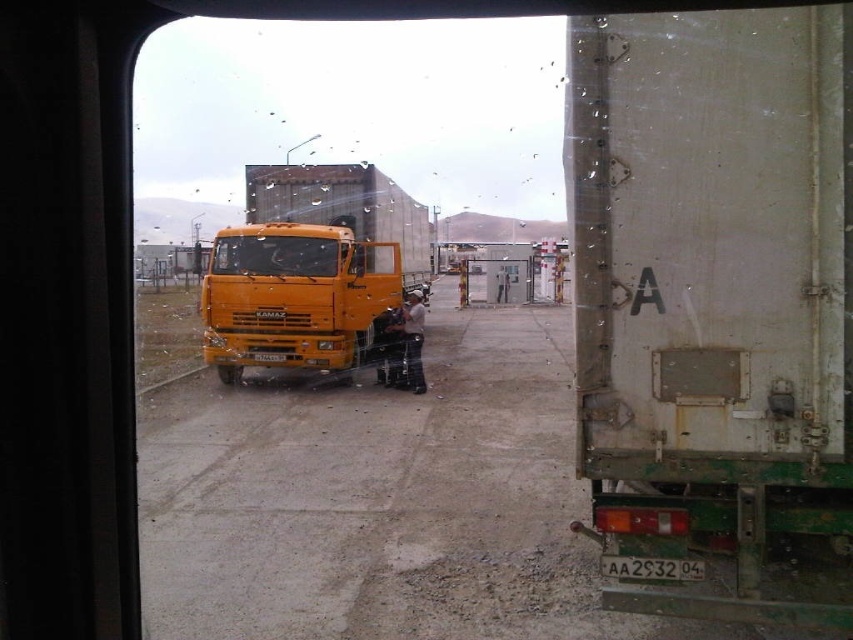
Question: Does rusty metal trailer at right appear on the left side of orange matte truck at center?

Choices:
 (A) no
 (B) yes

Answer: (A)

Question: Which point is farther to the camera?

Choices:
 (A) orange matte truck at center
 (B) rusty metal trailer at right

Answer: (A)

Question: Does rusty metal trailer at right appear on the left side of orange matte truck at center?

Choices:
 (A) no
 (B) yes

Answer: (A)

Question: Is rusty metal trailer at right above orange matte truck at center?

Choices:
 (A) no
 (B) yes

Answer: (A)